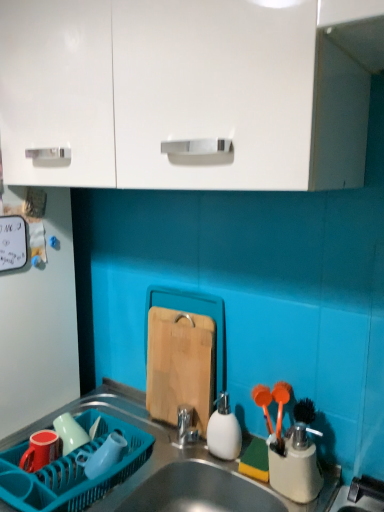
Identify the location of free spot in front of translucent blue plastic cup at lower left, positioned as the third tableware in left-to-right order. pyautogui.click(x=103, y=498).